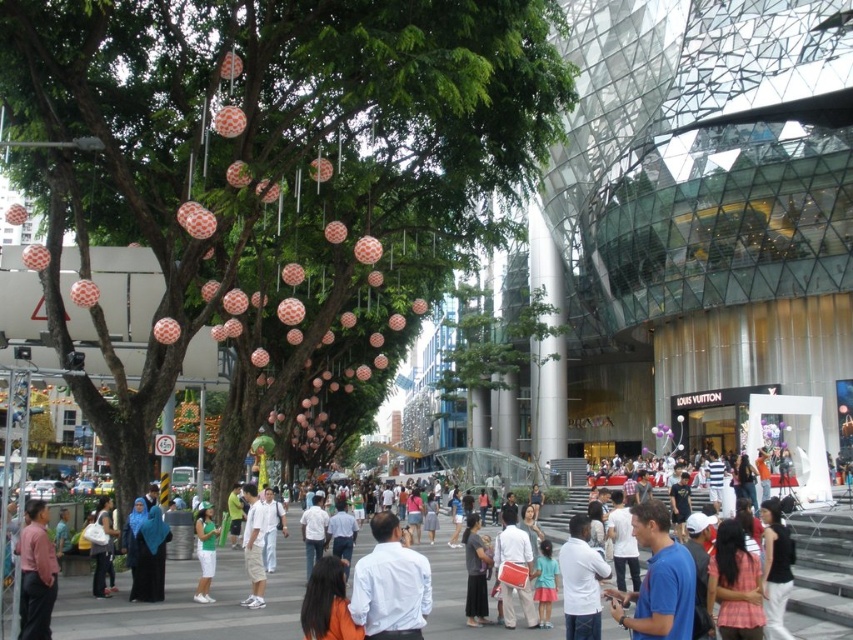
You are a photographer standing in the crowd. You want to take a photo that includes both the matte orange paper lanterns at center and the white cotton shirt at center. Given that your camera has a maximum focus range of 70 feet, will you be able to capture both subjects in focus without moving?

The matte orange paper lanterns at center is 71.91 feet from the white cotton shirt at center. Since the distance exceeds the camera maximum focus range of 70 feet, you cannot capture both subjects in focus without moving.

You are a photographer standing in the plaza and see the white matte shirt at center and the matte pink shirt at lower left. Which person is positioned higher in the frame?

The white matte shirt at center is positioned higher in the frame than the matte pink shirt at lower left.

You are a photographer standing in the crowd at the festive event. You want to take a photo of the white matte shirt at center and the matte orange paper lanterns at center. Which object should be placed in the background to ensure the other is in focus?

The matte orange paper lanterns at center are taller than the white matte shirt at center. To ensure the white matte shirt at center is in focus, place the taller matte orange paper lanterns at center in the background.